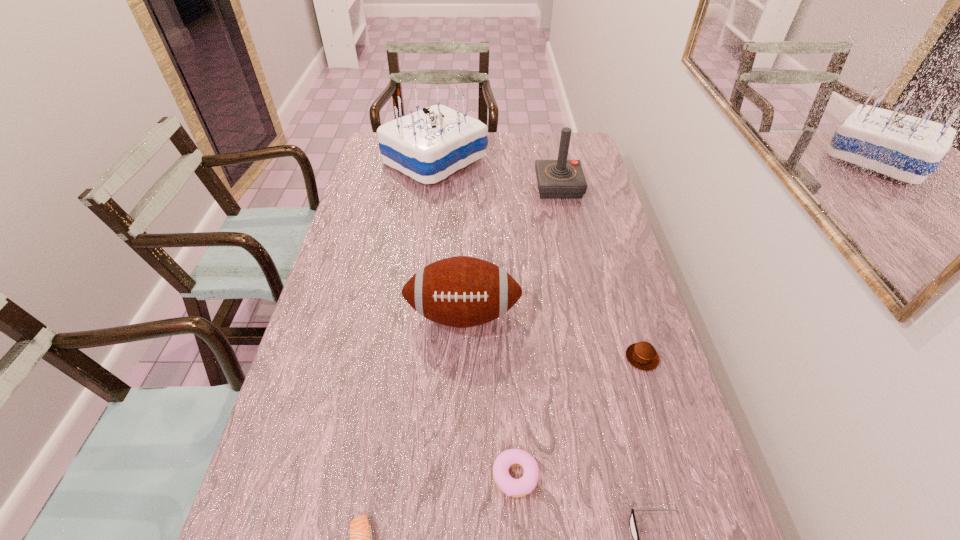
The width and height of the screenshot is (960, 540). I want to click on vacant space that satisfies the following two spatial constraints: 1. on the rectangular base of the muffin; 2. on the left side of the sixth shortest object, so click(x=595, y=357).

Find the location of a particular element. Image resolution: width=960 pixels, height=540 pixels. free space that satisfies the following two spatial constraints: 1. on the rectangular base of the muffin; 2. on the left side of the sixth shortest object is located at coordinates (595, 357).

The width and height of the screenshot is (960, 540). I want to click on free location that satisfies the following two spatial constraints: 1. on the rectangular base of the fourth shortest object; 2. on the left side of the second tallest object, so click(x=595, y=357).